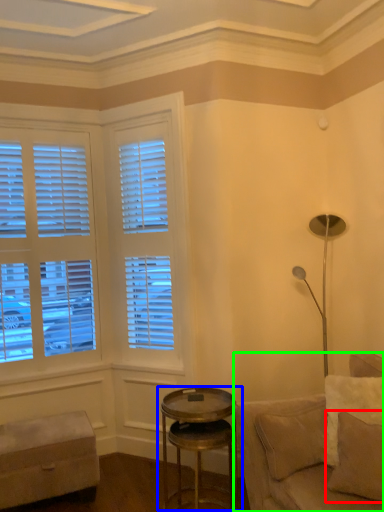
Question: Which object is the closest to the pillow (highlighted by a red box)? Choose among these: table (highlighted by a blue box) or studio couch (highlighted by a green box).

Choices:
 (A) table
 (B) studio couch

Answer: (B)